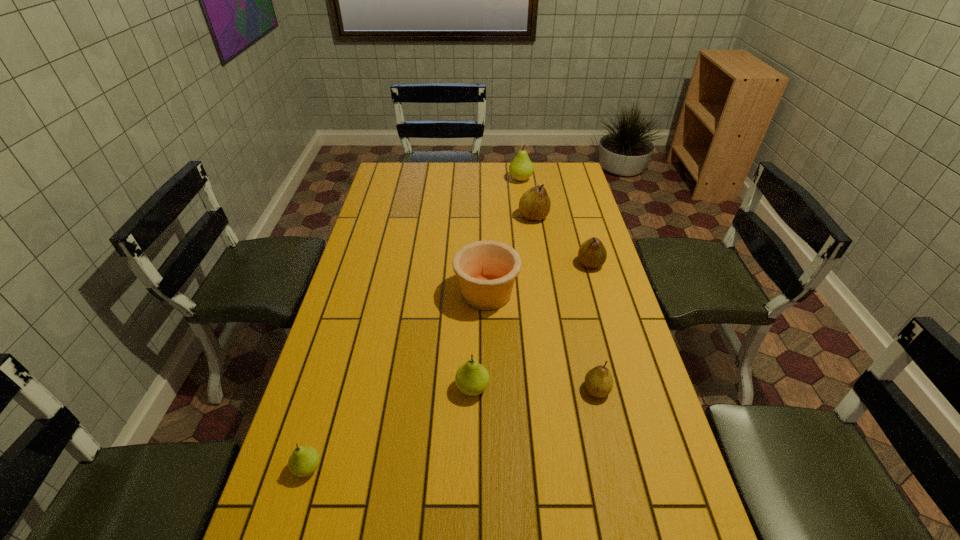
The width and height of the screenshot is (960, 540). What are the coordinates of `object that is positioned at the left edge` in the screenshot? It's located at (304, 460).

Find the location of a particular element. Image resolution: width=960 pixels, height=540 pixels. free space at the far edge is located at coordinates [442, 168].

In the image, there is a desktop. Where is `free space at the left edge`? Image resolution: width=960 pixels, height=540 pixels. free space at the left edge is located at coordinates (363, 262).

Find the location of `vacant space at the right edge of the desktop`. vacant space at the right edge of the desktop is located at coordinates (590, 300).

Identify the location of free spot between the fourth nearest pear and the second green pear from left to right. Image resolution: width=960 pixels, height=540 pixels. (532, 326).

Where is `free area in between the smallest green pear and the fifth nearest pear`? This screenshot has width=960, height=540. free area in between the smallest green pear and the fifth nearest pear is located at coordinates (420, 342).

Find the location of a particular element. This screenshot has height=540, width=960. vacant space that's between the third farthest pear and the second green pear from right to left is located at coordinates (532, 326).

The height and width of the screenshot is (540, 960). Find the location of `vacant point located between the second farthest brown pear and the pottery`. vacant point located between the second farthest brown pear and the pottery is located at coordinates (539, 279).

You are a GUI agent. You are given a task and a screenshot of the screen. Output one action in this format:
    pyautogui.click(x=<x>, y=<y>)
    Task: Click on the free space between the nearest object and the biggest brown pear
    The height and width of the screenshot is (540, 960).
    Given the screenshot: What is the action you would take?
    pyautogui.click(x=420, y=342)

This screenshot has width=960, height=540. Find the location of `object identified as the sixth closest to the biggest green pear`. object identified as the sixth closest to the biggest green pear is located at coordinates pyautogui.click(x=304, y=460).